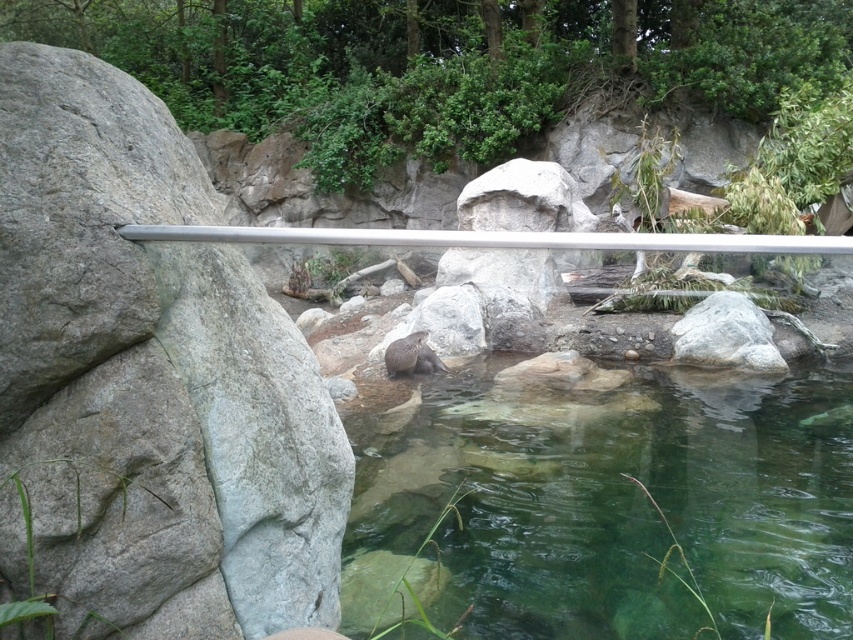
You are a zookeeper who needs to place a 1.5 meter long wooden plank between the gray rock at left and the silver metallic rail at center. Can the plank fit between them without bending?

The distance between the gray rock at left and the silver metallic rail at center is 1.46 meters. Since the plank is 1.5 meters long, it is slightly longer than the available space. Therefore, the plank cannot fit between them without bending.